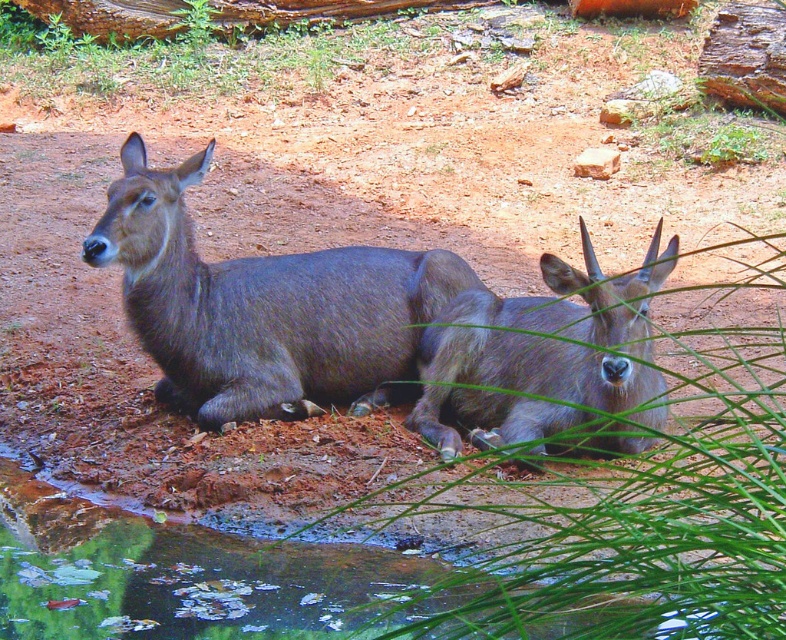
You are a park ranger observing the scene. You notice the green leafy grass at center and the gray matte deer at center. Based on their positions, which object is closer to the ground?

The green leafy grass at center is located below the gray matte deer at center, so the green leafy grass at center is closer to the ground.

You are standing at the origin point of the image coordinate system. You want to walk towards the point at the lower right corner. Which point, point at [382,320] or point at [465,412], would you encounter first?

You would encounter point at [465,412] first because it is closer to the lower right corner than point at [382,320], which is behind it.

You are a wildlife photographer aiming to capture both the shiny brown deer at center and the gray matte deer at center in a single frame. Given that your camera has a fixed focal length and limited field of view, which deer should you position closer to the camera to ensure both fit within the frame?

Since the shiny brown deer at center is wider than the gray matte deer at center, positioning the shiny brown deer at center closer to the camera will allow both to fit within the frame as the wider deer would occupy more space when closer.